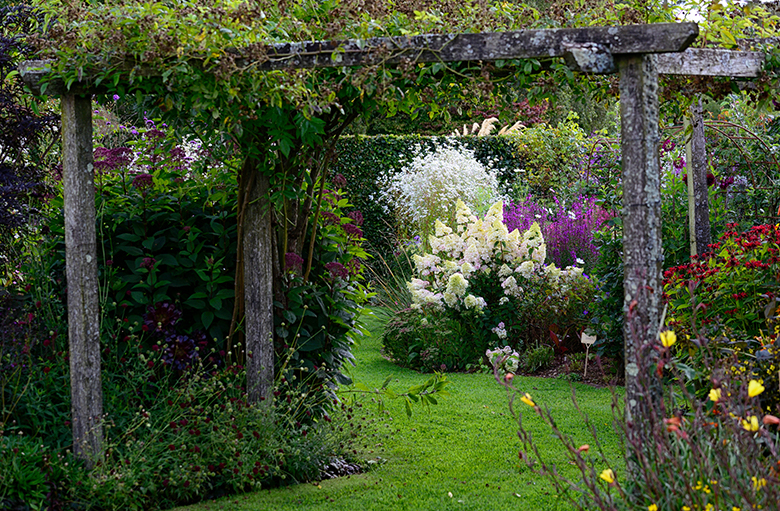
Locate an element on the screen. This screenshot has width=780, height=511. pampas grass is located at coordinates (490, 125), (509, 131).